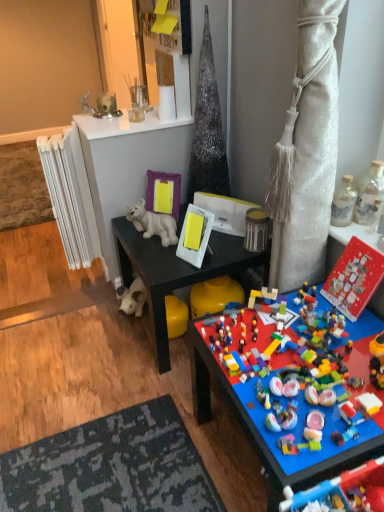
The width and height of the screenshot is (384, 512). I want to click on blank area to the left of black matte desk at center, so click(x=84, y=349).